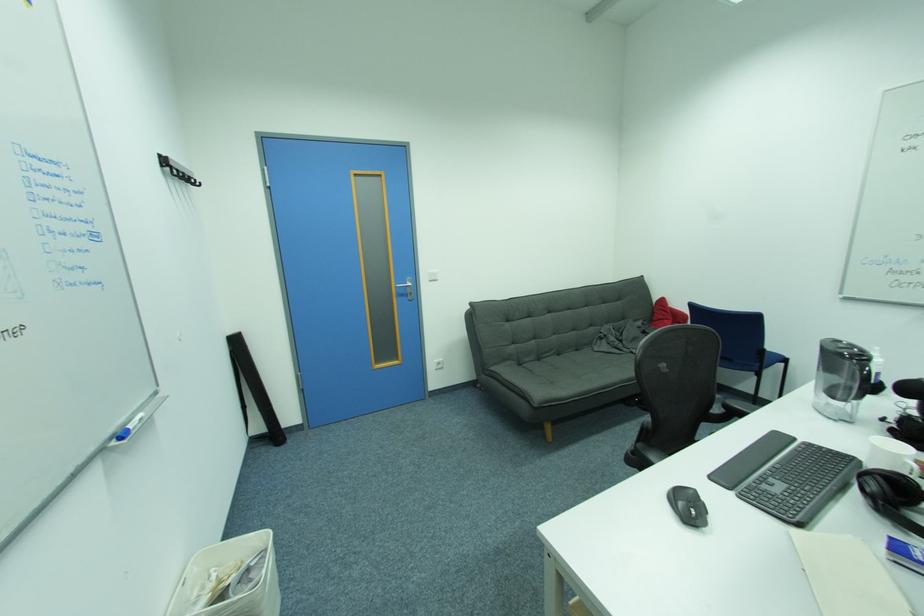
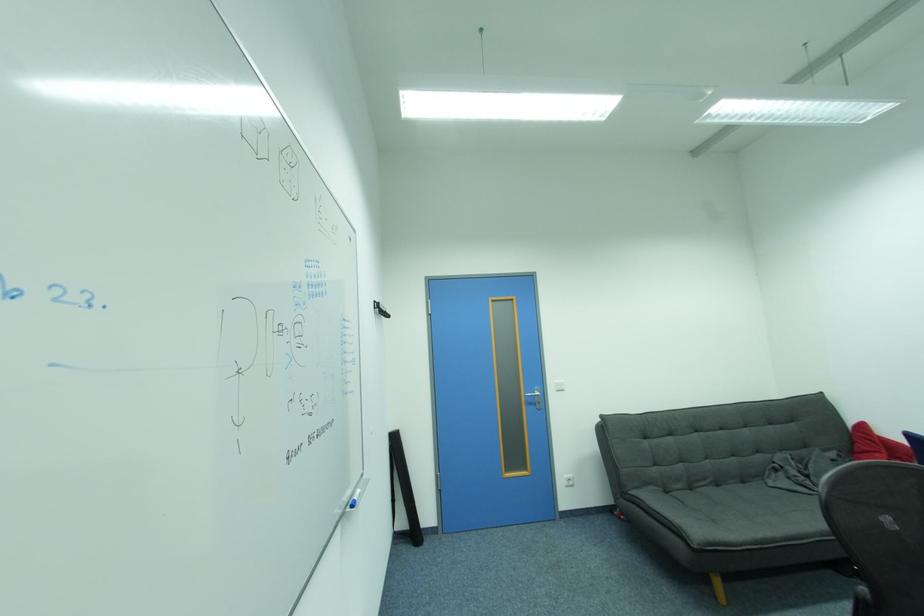
Locate, in the second image, the point that corresponds to pixel 403 288 in the first image.

(532, 397)